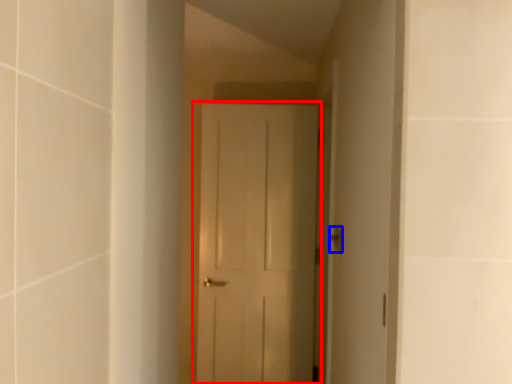
Question: Which object is closer to the camera taking this photo, door (highlighted by a red box) or door handle (highlighted by a blue box)?

Choices:
 (A) door
 (B) door handle

Answer: (B)